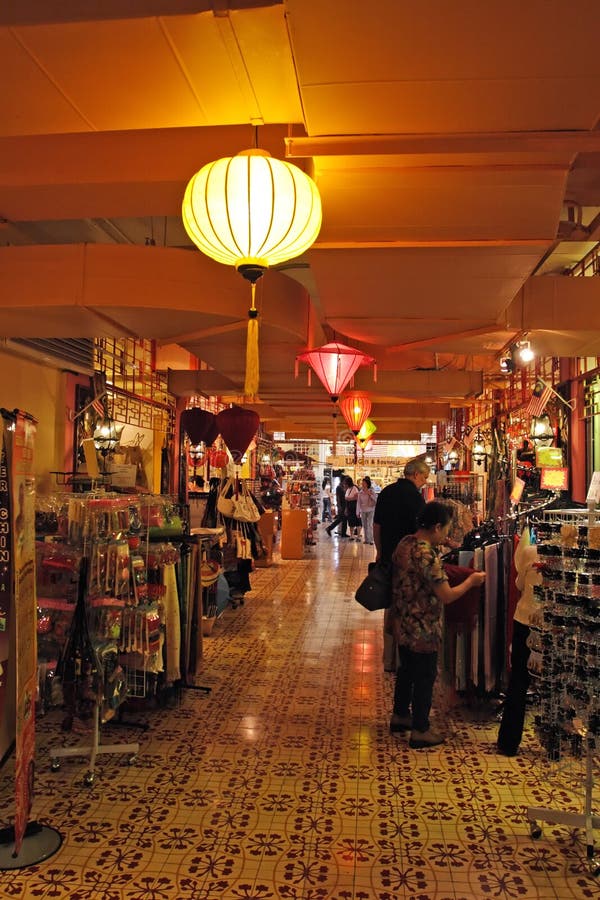
This screenshot has height=900, width=600. What are the coordinates of `yellow lantern` in the screenshot? It's located at (371, 429).